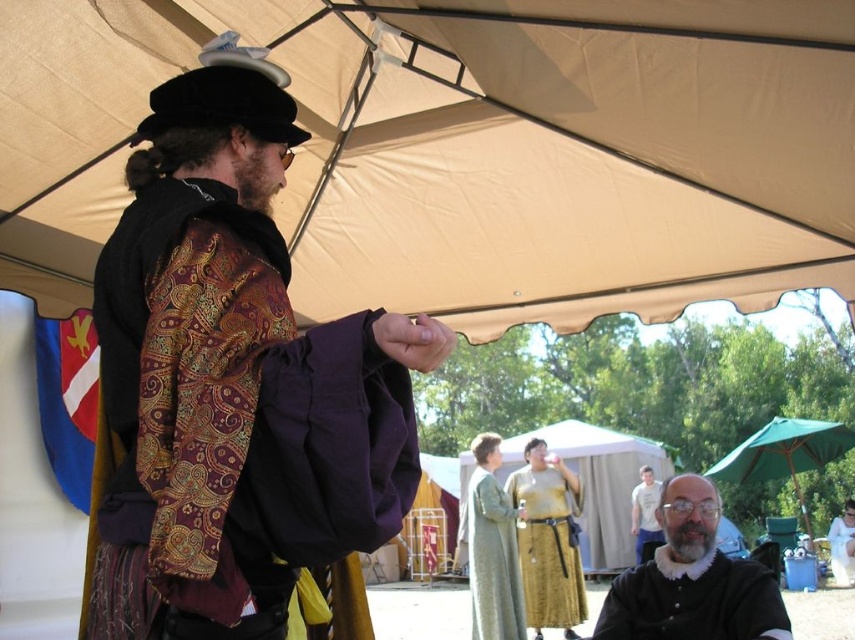
Between matte black shirt at center and golden fabric tent at center, which one is positioned lower?

golden fabric tent at center is below.

Does point (643, 637) come farther from viewer compared to point (599, 428)?

No, (643, 637) is closer to viewer.

This screenshot has width=855, height=640. Identify the location of matte black shirt at center. (693, 580).

Is beige canvas canopy at upper center wider than gold fabric skirt at center?

Yes, beige canvas canopy at upper center is wider than gold fabric skirt at center.

Does beige canvas canopy at upper center appear on the right side of gold fabric skirt at center?

Incorrect, beige canvas canopy at upper center is not on the right side of gold fabric skirt at center.

Is point (618, 301) farther from viewer compared to point (553, 492)?

No, it is in front of (553, 492).

Locate an element on the screen. The width and height of the screenshot is (855, 640). beige canvas canopy at upper center is located at coordinates (469, 148).

Does smooth gray robe at center have a smaller size compared to green fabric umbrella at lower right?

Yes, smooth gray robe at center is smaller than green fabric umbrella at lower right.

Which of these two, smooth gray robe at center or green fabric umbrella at lower right, stands shorter?

Standing shorter between the two is smooth gray robe at center.

This screenshot has width=855, height=640. I want to click on smooth gray robe at center, so click(x=492, y=561).